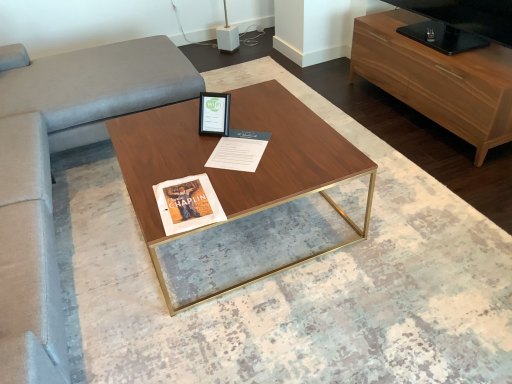
The height and width of the screenshot is (384, 512). In order to click on vacant space underneath white paper at center (from a real-world perspective) in this screenshot , I will do pyautogui.click(x=237, y=145).